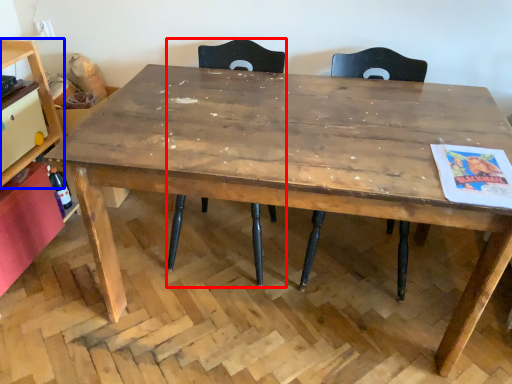
Question: Among these objects, which one is farthest to the camera, chair (highlighted by a red box) or shelf (highlighted by a blue box)?

Choices:
 (A) chair
 (B) shelf

Answer: (B)